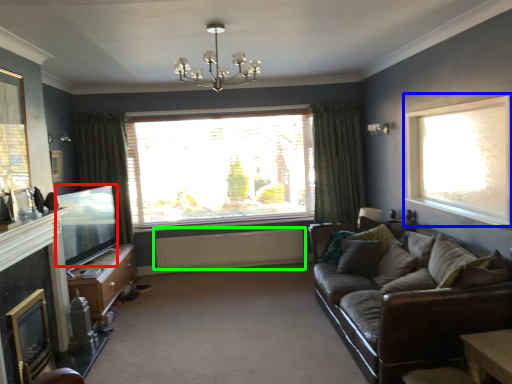
Question: Which object is positioned farthest from window screen (highlighted by a red box)? Select from window (highlighted by a blue box) and radiator (highlighted by a green box).

Choices:
 (A) window
 (B) radiator

Answer: (A)